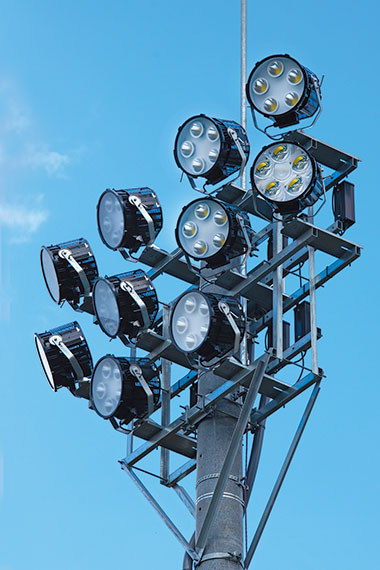
Locate an element on the screen. This screenshot has height=570, width=380. spotlights is located at coordinates (119, 393), (57, 353), (62, 272), (130, 309), (130, 221), (213, 146), (213, 223), (192, 316), (279, 193), (273, 93).